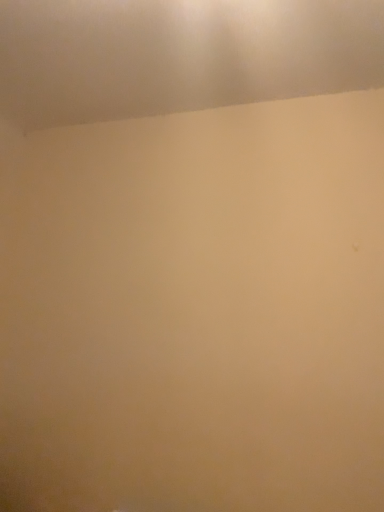
The image size is (384, 512). What do you see at coordinates (179, 55) in the screenshot? I see `white matte ceiling at upper center` at bounding box center [179, 55].

You are a GUI agent. You are given a task and a screenshot of the screen. Output one action in this format:
    pyautogui.click(x=<x>, y=<y>)
    Task: Click on the white matte ceiling at upper center
    The width and height of the screenshot is (384, 512).
    Given the screenshot: What is the action you would take?
    pyautogui.click(x=179, y=55)

In order to click on white matte ceiling at upper center in this screenshot , I will do `click(179, 55)`.